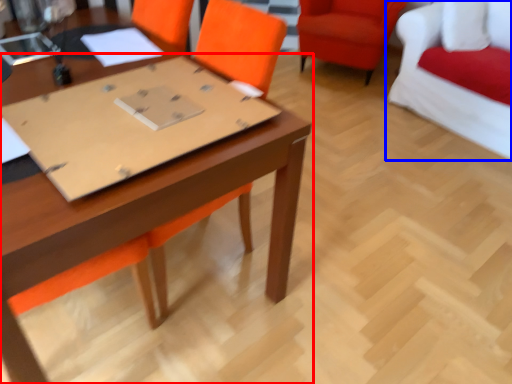
Question: Which of the following is the farthest to the observer, table (highlighted by a red box) or chair (highlighted by a blue box)?

Choices:
 (A) table
 (B) chair

Answer: (B)